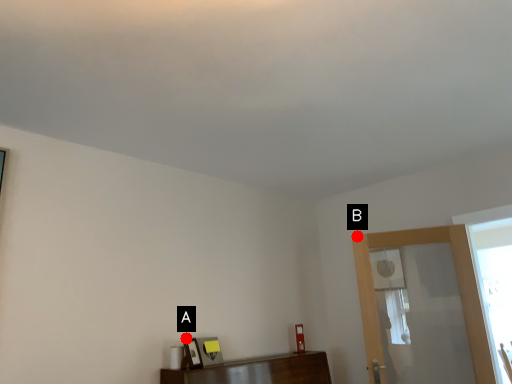
Question: Two points are circled on the image, labeled by A and B beside each circle. Among these points, which one is nearest to the camera?

Choices:
 (A) A is closer
 (B) B is closer

Answer: (A)